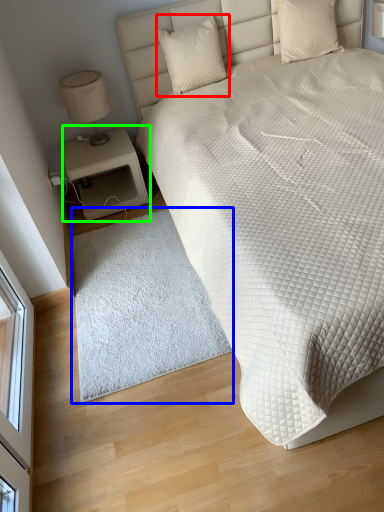
Question: Which object is the closest to the pillow (highlighted by a red box)? Choose among these: mat (highlighted by a blue box) or nightstand (highlighted by a green box).

Choices:
 (A) mat
 (B) nightstand

Answer: (B)